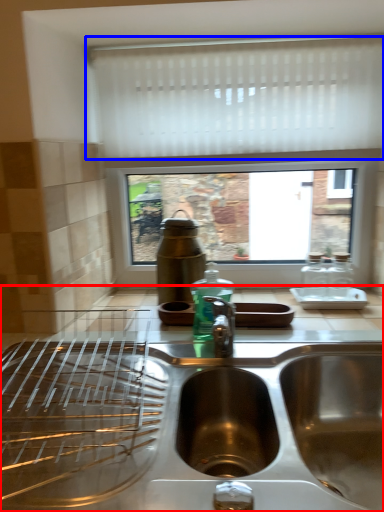
Question: Which object is further to the camera taking this photo, countertop (highlighted by a red box) or curtain (highlighted by a blue box)?

Choices:
 (A) countertop
 (B) curtain

Answer: (B)